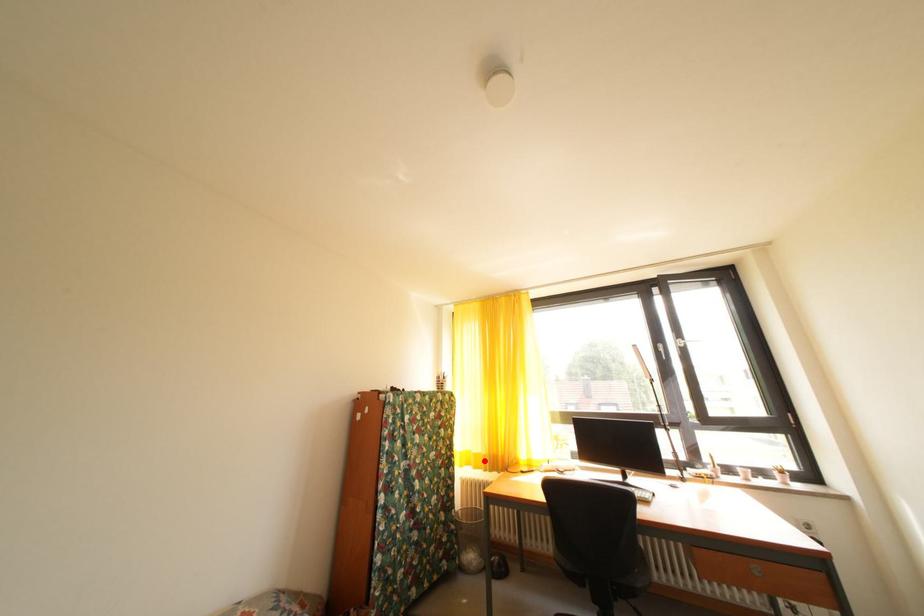
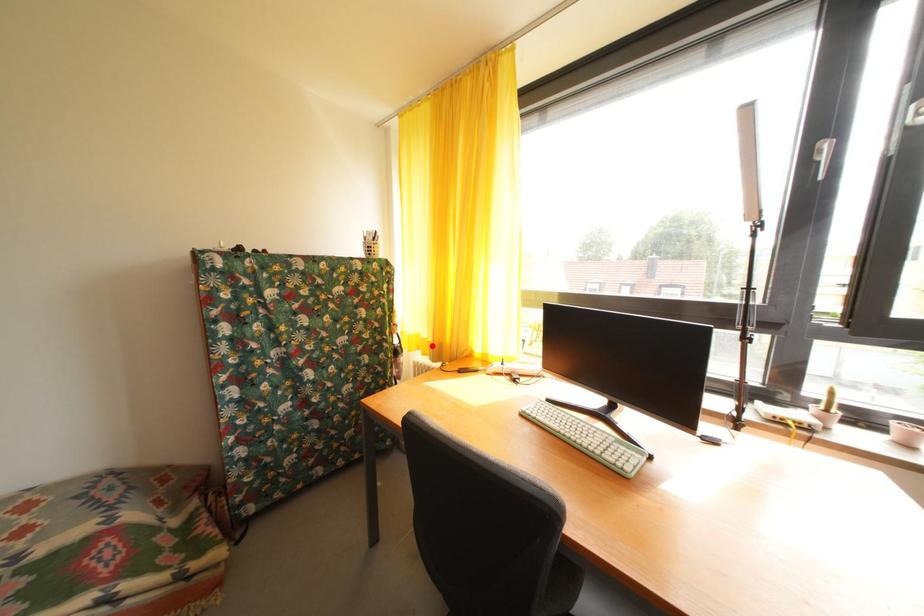
I am providing you with two images of the same scene from different viewpoints. A red point is marked on the first image and another point is marked on the second image. Is the red point in image1 aligned with the point shown in image2?

Yes